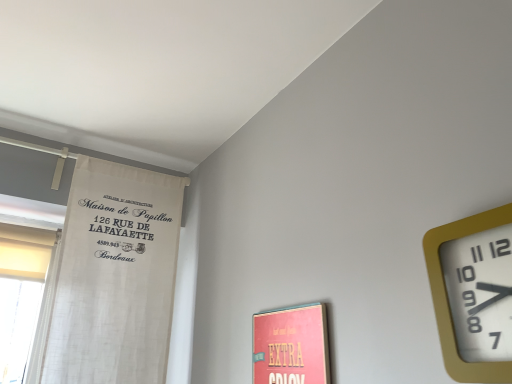
Question: Considering the positions of white fabric curtain at left and gold plastic wall clock at upper right in the image, is white fabric curtain at left bigger or smaller than gold plastic wall clock at upper right?

Choices:
 (A) big
 (B) small

Answer: (A)

Question: Do you think white fabric curtain at left is within gold plastic wall clock at upper right, or outside of it?

Choices:
 (A) outside
 (B) inside

Answer: (A)

Question: From a real-world perspective, is white fabric curtain at left above or below gold plastic wall clock at upper right?

Choices:
 (A) below
 (B) above

Answer: (B)

Question: From the image's perspective, is gold plastic wall clock at upper right positioned above or below white fabric curtain at left?

Choices:
 (A) below
 (B) above

Answer: (B)

Question: From a real-world perspective, is gold plastic wall clock at upper right above or below white fabric curtain at left?

Choices:
 (A) above
 (B) below

Answer: (B)

Question: Does point (455, 226) appear closer or farther from the camera than point (101, 263)?

Choices:
 (A) closer
 (B) farther

Answer: (A)

Question: Is gold plastic wall clock at upper right to the left or to the right of white fabric curtain at left in the image?

Choices:
 (A) left
 (B) right

Answer: (B)